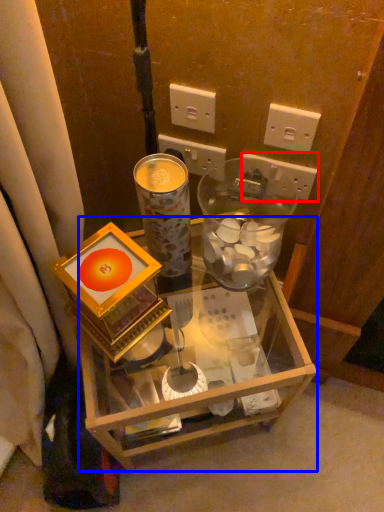
Question: Which object appears farthest to the camera in this image, power outlet (highlighted by a red box) or desk (highlighted by a blue box)?

Choices:
 (A) power outlet
 (B) desk

Answer: (A)